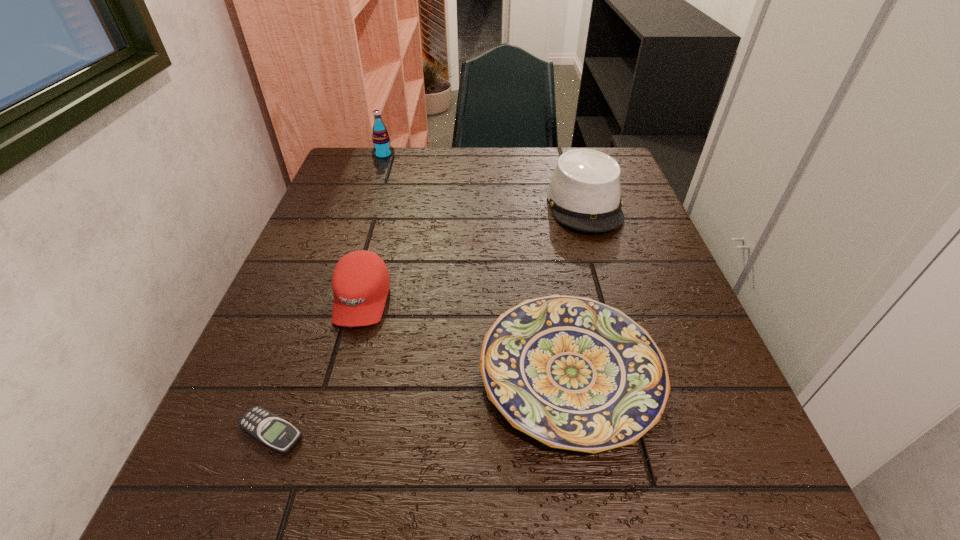
The width and height of the screenshot is (960, 540). What are the coordinates of `soda` in the screenshot? It's located at (382, 149).

Find the location of a particular element. the farthest object is located at coordinates tap(382, 149).

Identify the location of hat. This screenshot has width=960, height=540. (584, 193).

The width and height of the screenshot is (960, 540). I want to click on the second tallest object, so click(x=584, y=193).

In order to click on cap in this screenshot , I will do `click(360, 282)`.

The width and height of the screenshot is (960, 540). What are the coordinates of `the second shortest object` in the screenshot? It's located at (573, 373).

I want to click on beeper, so click(x=271, y=430).

Locate an element on the screen. The height and width of the screenshot is (540, 960). vacant space situated on the right of the farthest object is located at coordinates (464, 156).

Image resolution: width=960 pixels, height=540 pixels. I want to click on free region located 0.370m on the front-facing side of the second farthest object, so click(x=638, y=379).

Locate an element on the screen. vacant region located on the front-facing side of the cap is located at coordinates (347, 356).